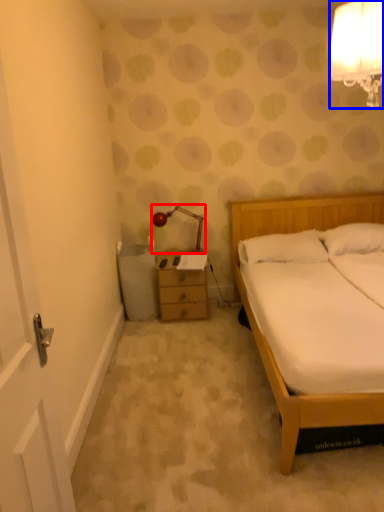
Question: Which object is further to the camera taking this photo, lamp (highlighted by a red box) or lamp (highlighted by a blue box)?

Choices:
 (A) lamp
 (B) lamp

Answer: (A)